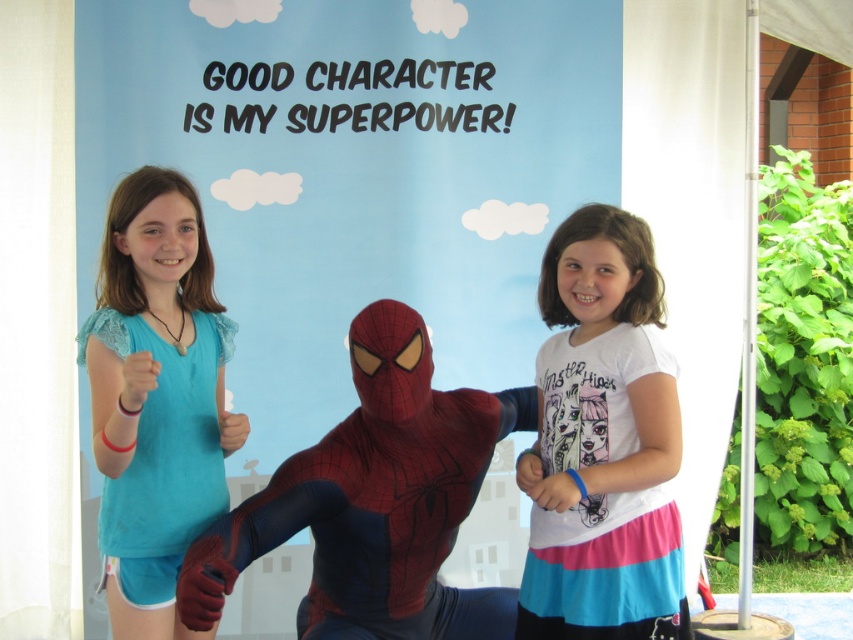
Question: Among these points, which one is nearest to the camera?

Choices:
 (A) (619, 314)
 (B) (109, 202)

Answer: (A)

Question: Is blue paper at center thinner than matte blue shirt at left?

Choices:
 (A) yes
 (B) no

Answer: (B)

Question: Is shiny spandex suit at center above matte blue shirt at left?

Choices:
 (A) no
 (B) yes

Answer: (A)

Question: Which object appears farthest from the camera in this image?

Choices:
 (A) matte blue shirt at left
 (B) shiny spandex suit at center
 (C) blue paper at center
 (D) white cotton shirt at center

Answer: (C)

Question: Estimate the real-world distances between objects in this image. Which object is farther from the shiny spandex suit at center?

Choices:
 (A) blue paper at center
 (B) matte blue shirt at left

Answer: (A)

Question: Does shiny spandex suit at center have a smaller size compared to matte blue shirt at left?

Choices:
 (A) yes
 (B) no

Answer: (B)